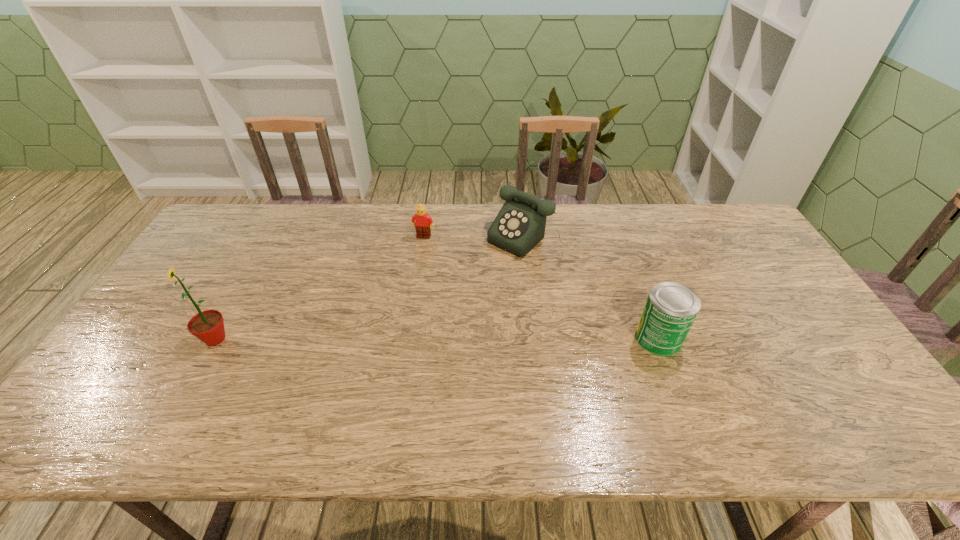
Identify the location of free space between the Lego and the third object from left to right. (478, 237).

Where is `the closest object relative to the rightmost object`? This screenshot has height=540, width=960. the closest object relative to the rightmost object is located at coordinates (520, 225).

Locate an element on the screen. Image resolution: width=960 pixels, height=540 pixels. object identified as the third closest to the shortest object is located at coordinates (671, 308).

Identify the location of free spot that satisfies the following two spatial constraints: 1. on the front side of the third object from left to right; 2. on the right side of the rightmost object. The height and width of the screenshot is (540, 960). (547, 338).

Where is `free space that satisfies the following two spatial constraints: 1. on the front side of the telephone; 2. on the right side of the rightmost object`? free space that satisfies the following two spatial constraints: 1. on the front side of the telephone; 2. on the right side of the rightmost object is located at coordinates (547, 338).